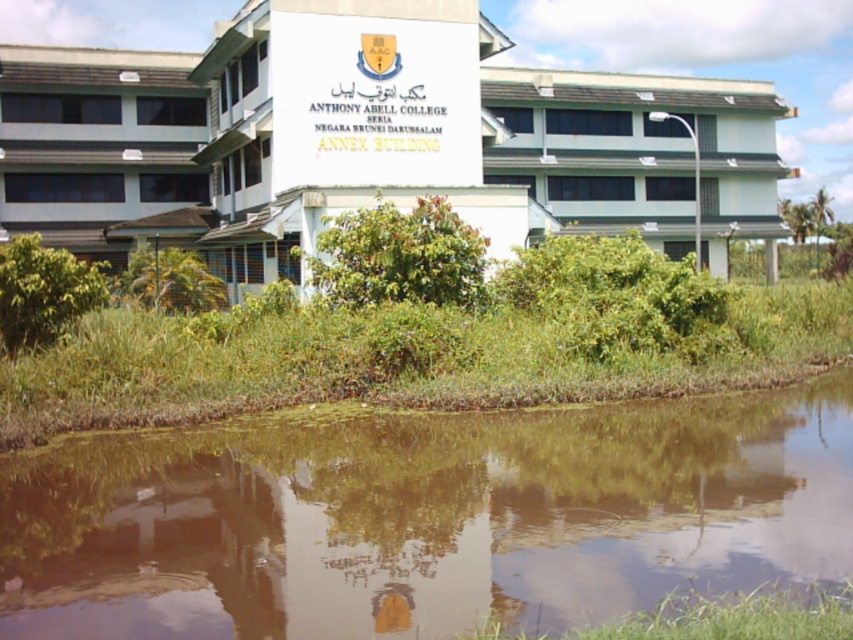
Question: Does green mossy water at lower center have a larger size compared to white smooth building at center?

Choices:
 (A) no
 (B) yes

Answer: (A)

Question: Can you confirm if green mossy water at lower center is positioned above white smooth building at center?

Choices:
 (A) no
 (B) yes

Answer: (A)

Question: Can you confirm if green mossy water at lower center is smaller than white smooth building at center?

Choices:
 (A) yes
 (B) no

Answer: (A)

Question: Among these points, which one is farthest from the camera?

Choices:
 (A) (305, 492)
 (B) (582, 192)

Answer: (B)